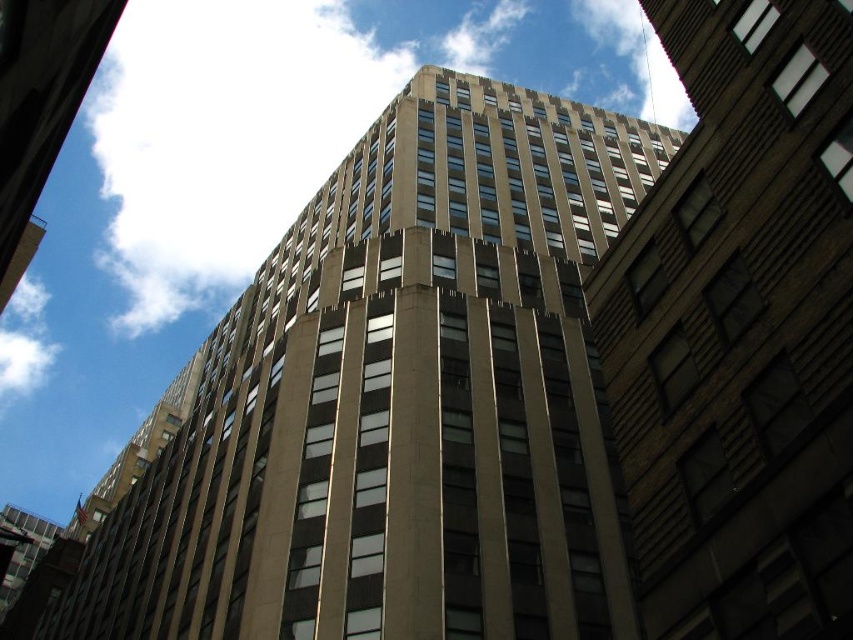
Question: Among these objects, which one is farthest from the camera?

Choices:
 (A) white fluffy cloud at upper center
 (B) beige concrete building at center
 (C) brown stone building at center

Answer: (A)

Question: Can you confirm if brown stone building at center is positioned to the right of white fluffy cloud at upper center?

Choices:
 (A) yes
 (B) no

Answer: (A)

Question: Is beige concrete building at center below white fluffy cloud at upper center?

Choices:
 (A) yes
 (B) no

Answer: (A)

Question: Which point is closer to the camera taking this photo?

Choices:
 (A) (773, 304)
 (B) (561, 486)

Answer: (A)

Question: Does beige concrete building at center appear under brown stone building at center?

Choices:
 (A) yes
 (B) no

Answer: (A)

Question: Which object is the closest to the beige concrete building at center?

Choices:
 (A) white fluffy cloud at upper center
 (B) brown stone building at center

Answer: (B)